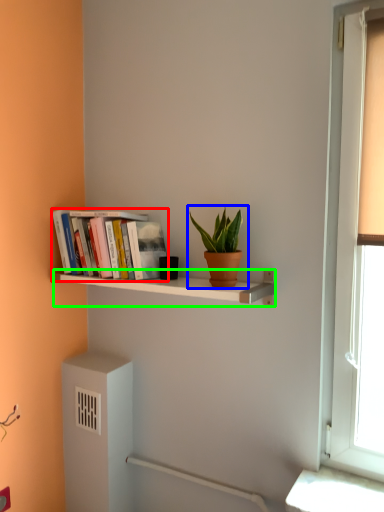
Question: Estimate the real-world distances between objects in this image. Which object is farther from book (highlighted by a red box), houseplant (highlighted by a blue box) or shelf (highlighted by a green box)?

Choices:
 (A) houseplant
 (B) shelf

Answer: (A)